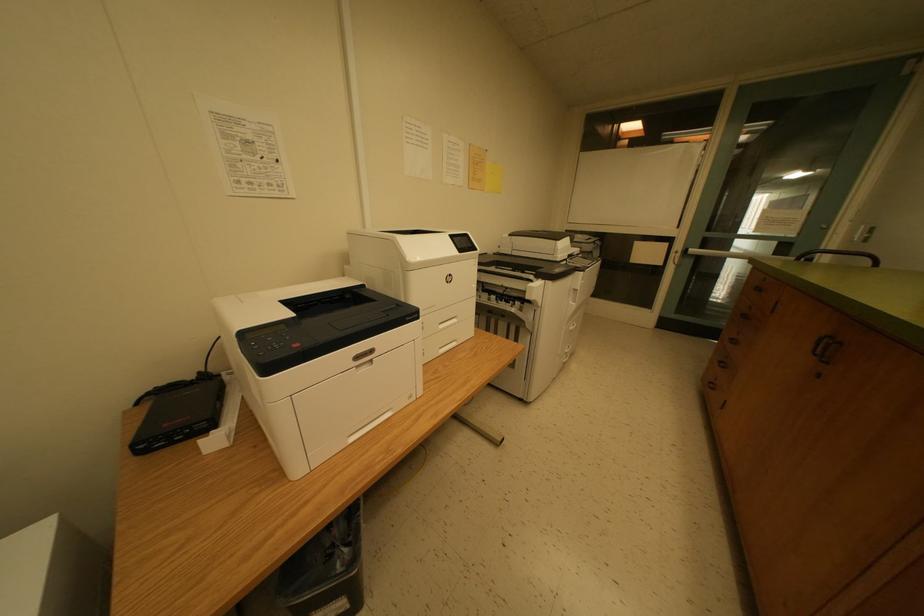
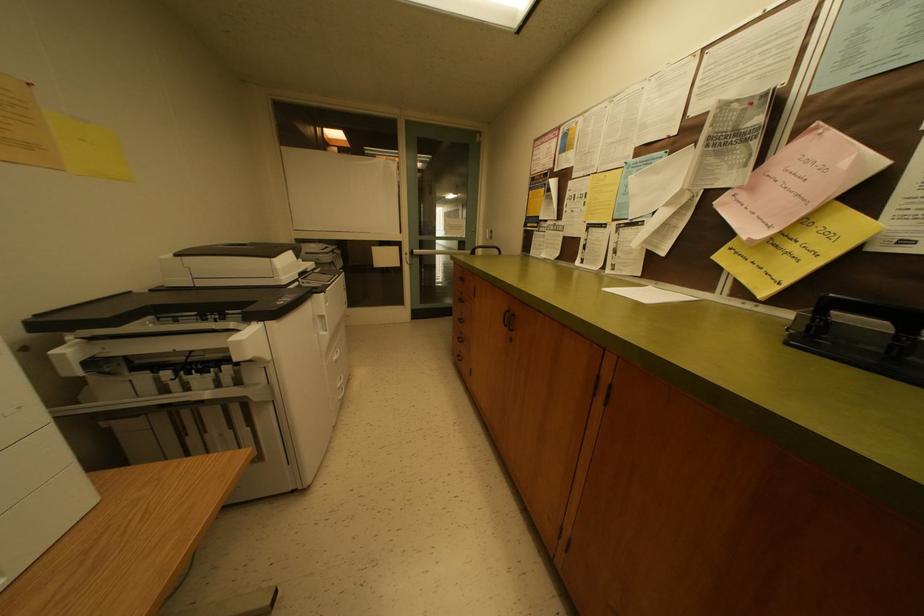
Question: The first image is from the beginning of the video and the second image is from the end. How did the camera likely rotate when shooting the video?

Choices:
 (A) Left
 (B) Right
 (C) Up
 (D) Down

Answer: (B)